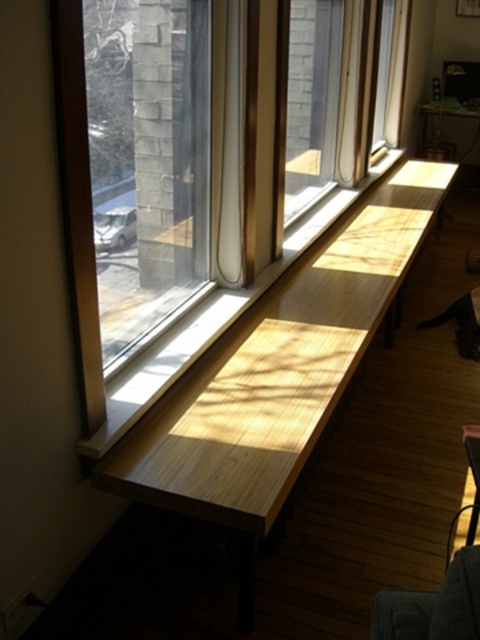
Question: Among these objects, which one is nearest to the camera?

Choices:
 (A) natural wood bench at center
 (B) transparent glass window at center
 (C) dark gray fabric armchair at lower right

Answer: (C)

Question: Is natural wood bench at center positioned at the back of dark gray fabric armchair at lower right?

Choices:
 (A) no
 (B) yes

Answer: (B)

Question: Among these points, which one is farthest from the camera?

Choices:
 (A) (295, 435)
 (B) (373, 637)
 (C) (109, 227)

Answer: (C)

Question: Does natural wood bench at center appear over dark gray fabric armchair at lower right?

Choices:
 (A) no
 (B) yes

Answer: (B)

Question: Which point appears closest to the camera in this image?

Choices:
 (A) (143, 262)
 (B) (416, 620)
 (C) (276, 502)

Answer: (B)

Question: Is transparent glass window at center to the left of dark gray fabric armchair at lower right from the viewer's perspective?

Choices:
 (A) no
 (B) yes

Answer: (B)